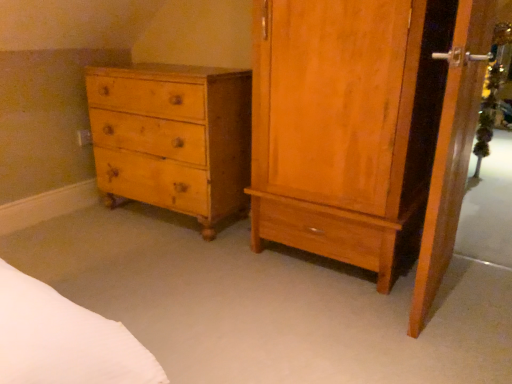
Find the location of a particular element. Image resolution: width=512 pixels, height=384 pixels. vacant area that lies between wooden screen door at right and light brown wood cabinet at right is located at coordinates pyautogui.click(x=333, y=296).